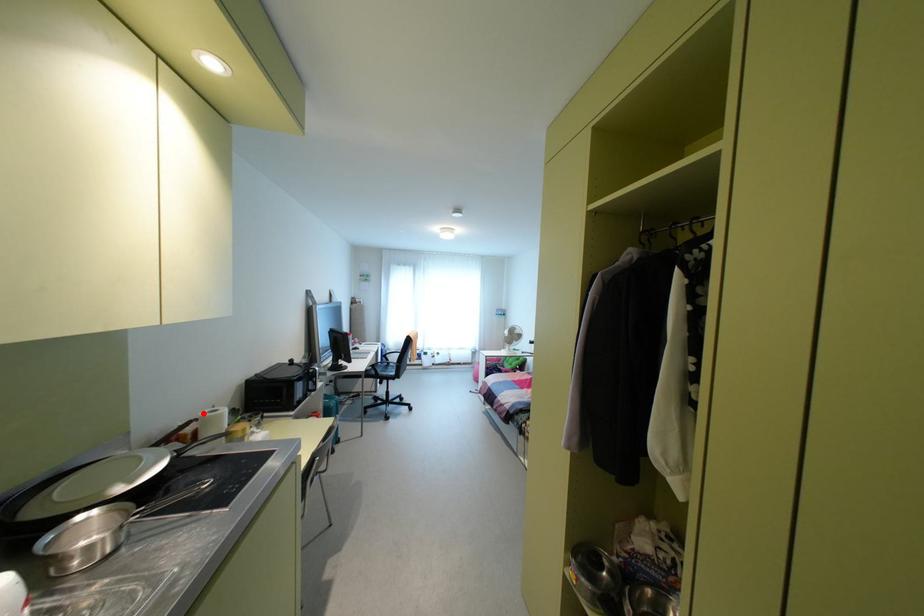
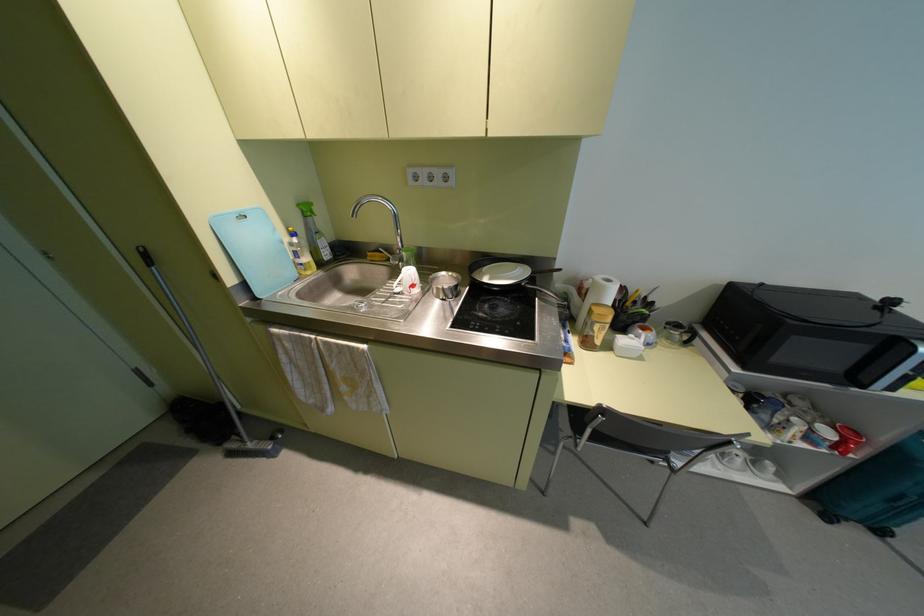
Where in the second image is the point corresponding to the highlighted location from the first image?

(599, 277)